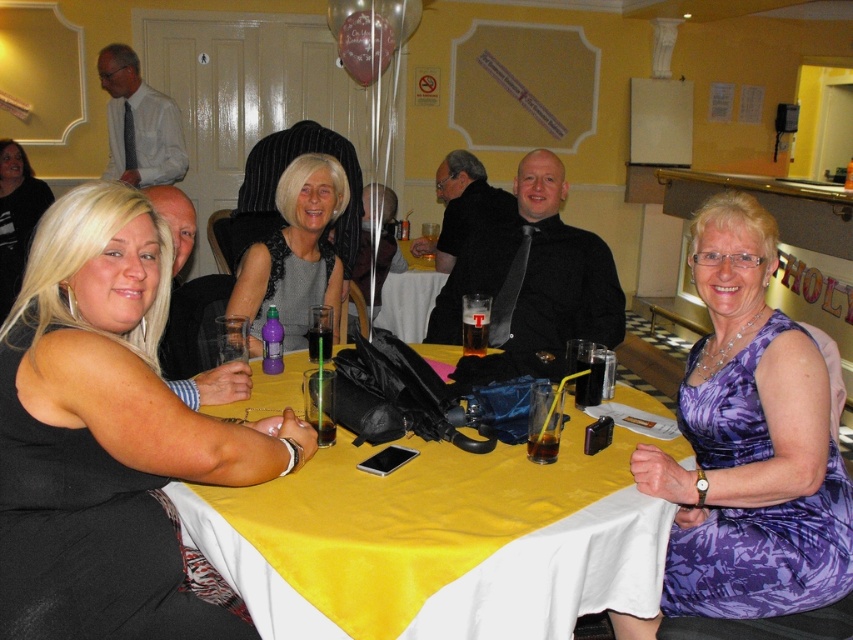
Question: Is purple satin dress at center bigger than blonde hair at lower left?

Choices:
 (A) no
 (B) yes

Answer: (A)

Question: Which object is positioned farthest from the blonde hair at lower left?

Choices:
 (A) purple satin dress at center
 (B) yellow satin tablecloth at center

Answer: (A)

Question: Which object appears farthest from the camera in this image?

Choices:
 (A) yellow fabric table at center
 (B) blonde hair at lower left
 (C) matte black dress at center

Answer: (B)

Question: Does purple satin dress at center lie in front of yellow fabric table at center?

Choices:
 (A) no
 (B) yes

Answer: (B)

Question: Which point is farther to the camera?

Choices:
 (A) (91, 516)
 (B) (314, 275)
 (C) (3, 243)
 (D) (809, 566)

Answer: (C)

Question: Does purple satin dress at center have a greater width compared to yellow fabric table at center?

Choices:
 (A) no
 (B) yes

Answer: (B)